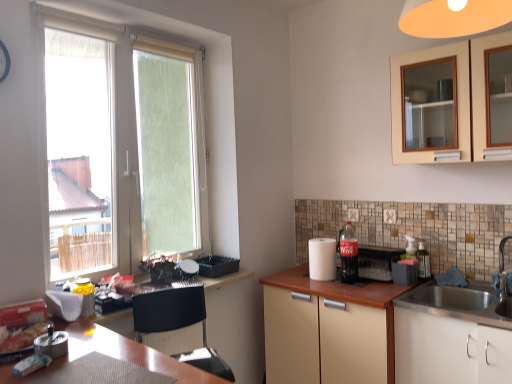
The image size is (512, 384). What are the coordinates of `free space in front of red glass coca-cola bottle at center-right` in the screenshot? It's located at (355, 289).